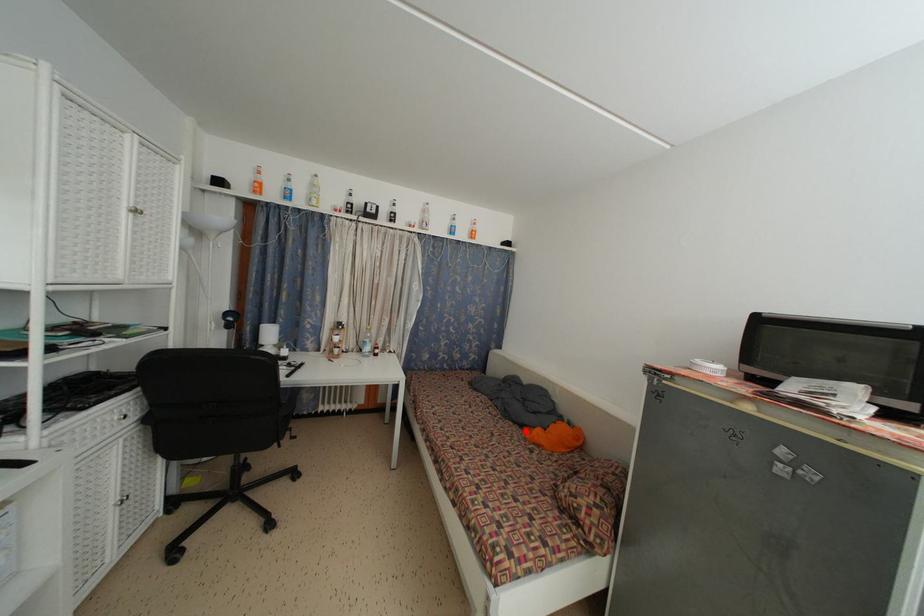
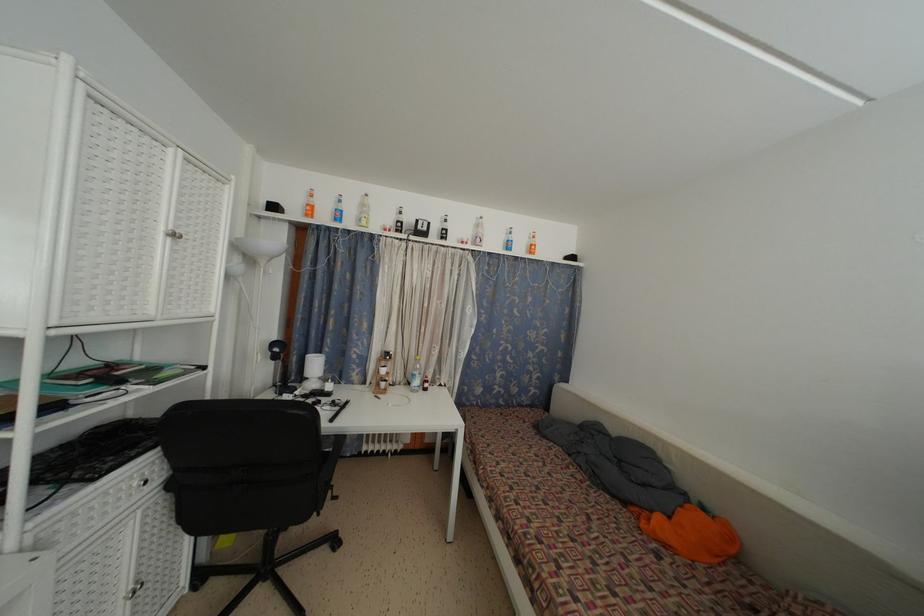
The point at the highlighted location is marked in the first image. Where is the corresponding point in the second image?

(629, 509)